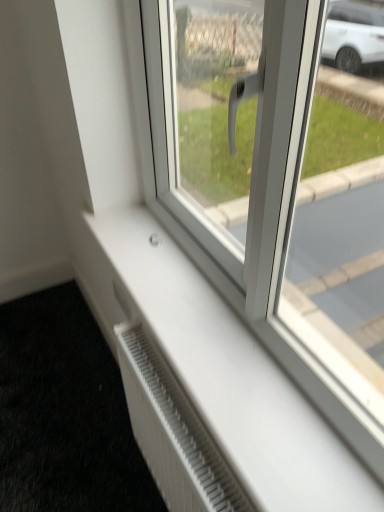
Find the location of a particular element. free space above white plastic window at center (from a real-world perspective) is located at coordinates (204, 319).